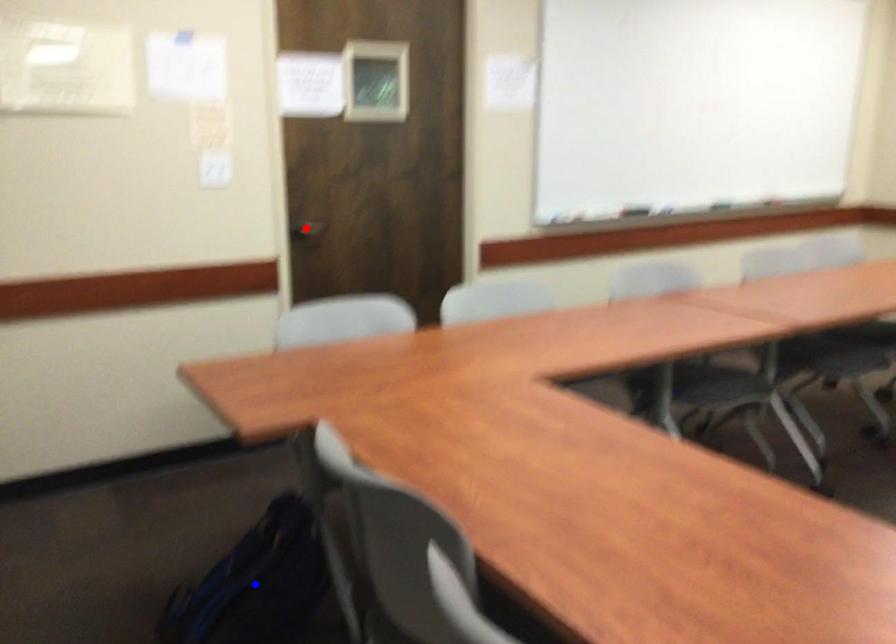
Question: Which of the two points in the image is closer to the camera?

Choices:
 (A) Blue point is closer.
 (B) Red point is closer.

Answer: (A)